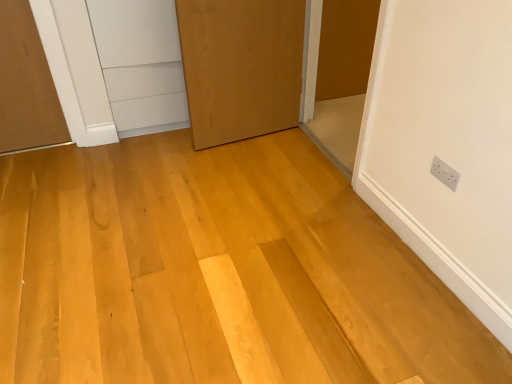
Question: From the image's perspective, is matte brown door at upper right, which is the 2th door in left-to-right order, below white plastic electric outlet at upper right?

Choices:
 (A) no
 (B) yes

Answer: (A)

Question: Is matte brown door at upper right, which is counted as the first door, starting from the right, shorter than white plastic electric outlet at upper right?

Choices:
 (A) yes
 (B) no

Answer: (B)

Question: Is matte brown door at upper right, which is the 2th door in left-to-right order, in front of white plastic electric outlet at upper right?

Choices:
 (A) no
 (B) yes

Answer: (A)

Question: Can you confirm if matte brown door at upper right, which is counted as the first door, starting from the right, is wider than white plastic electric outlet at upper right?

Choices:
 (A) no
 (B) yes

Answer: (B)

Question: Is matte brown door at upper right, which is the 2th door in left-to-right order, bigger than white plastic electric outlet at upper right?

Choices:
 (A) no
 (B) yes

Answer: (B)

Question: From a real-world perspective, is matte brown door at upper right, which is counted as the first door, starting from the right, under white plastic electric outlet at upper right?

Choices:
 (A) no
 (B) yes

Answer: (B)

Question: Is natural wood floor at center to the right of wooden door at center, arranged as the 2th door when viewed from the right, from the viewer's perspective?

Choices:
 (A) yes
 (B) no

Answer: (B)

Question: Considering the relative sizes of natural wood floor at center and wooden door at center, the 1th door when ordered from left to right, in the image provided, is natural wood floor at center wider than wooden door at center, the 1th door when ordered from left to right,?

Choices:
 (A) yes
 (B) no

Answer: (A)

Question: Considering the relative positions of natural wood floor at center and wooden door at center, arranged as the 2th door when viewed from the right, in the image provided, is natural wood floor at center in front of wooden door at center, arranged as the 2th door when viewed from the right,?

Choices:
 (A) yes
 (B) no

Answer: (A)

Question: Is natural wood floor at center shorter than wooden door at center, the 1th door when ordered from left to right?

Choices:
 (A) no
 (B) yes

Answer: (B)

Question: From a real-world perspective, does natural wood floor at center sit lower than wooden door at center, arranged as the 2th door when viewed from the right?

Choices:
 (A) no
 (B) yes

Answer: (B)

Question: Is natural wood floor at center oriented towards wooden door at center, arranged as the 2th door when viewed from the right?

Choices:
 (A) yes
 (B) no

Answer: (B)

Question: Is white plastic electric outlet at upper right outside of wooden door at center, arranged as the 2th door when viewed from the right?

Choices:
 (A) yes
 (B) no

Answer: (A)